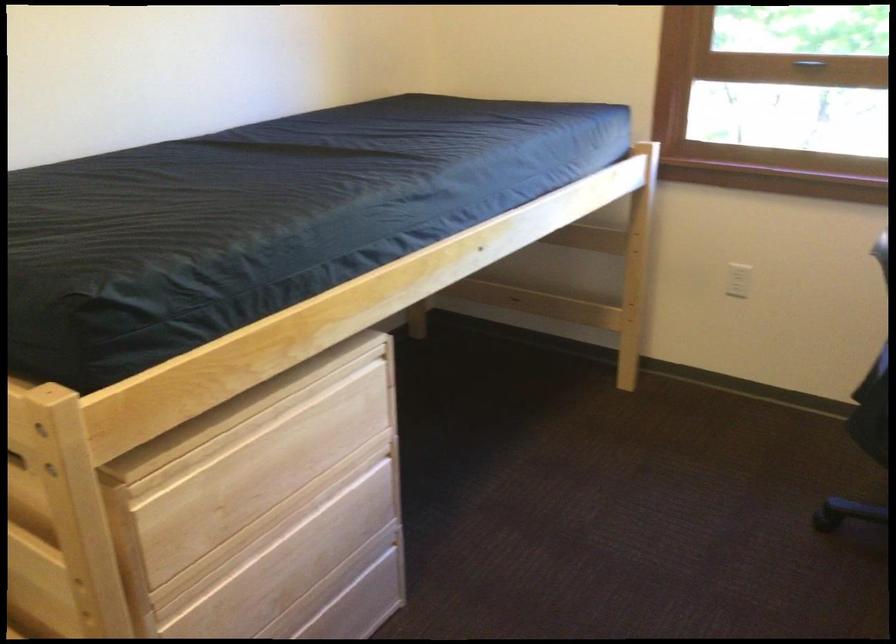
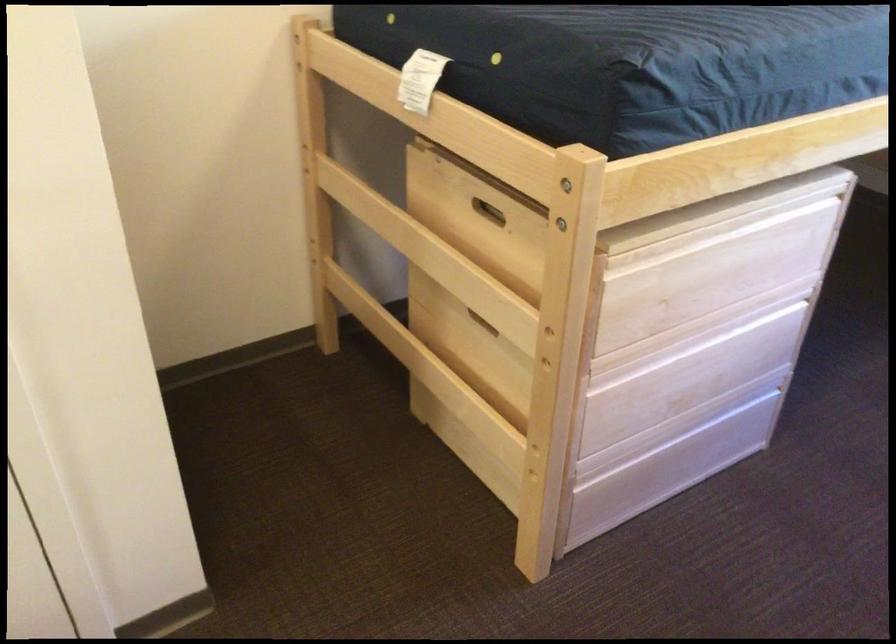
Where in the second image is the point corresponding to the point at 306,525 from the first image?

(718, 342)